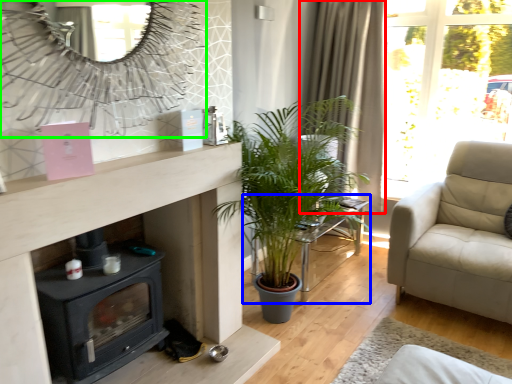
Question: Which object is the closest to the curtain (highlighted by a red box)? Choose among these: table (highlighted by a blue box) or mirror (highlighted by a green box).

Choices:
 (A) table
 (B) mirror

Answer: (A)